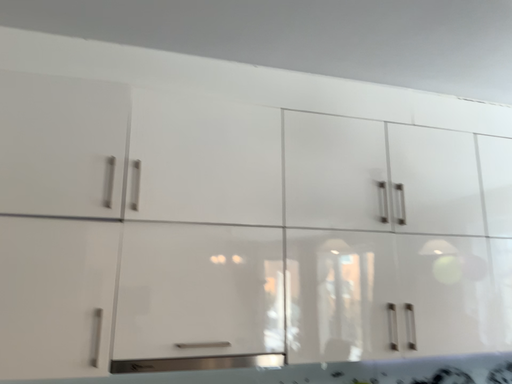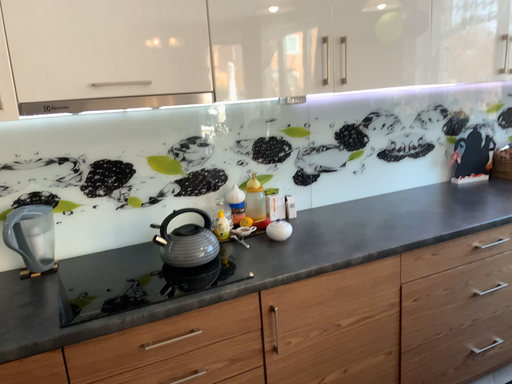
Question: Which way did the camera rotate in the video?

Choices:
 (A) rotated downward
 (B) rotated upward

Answer: (A)